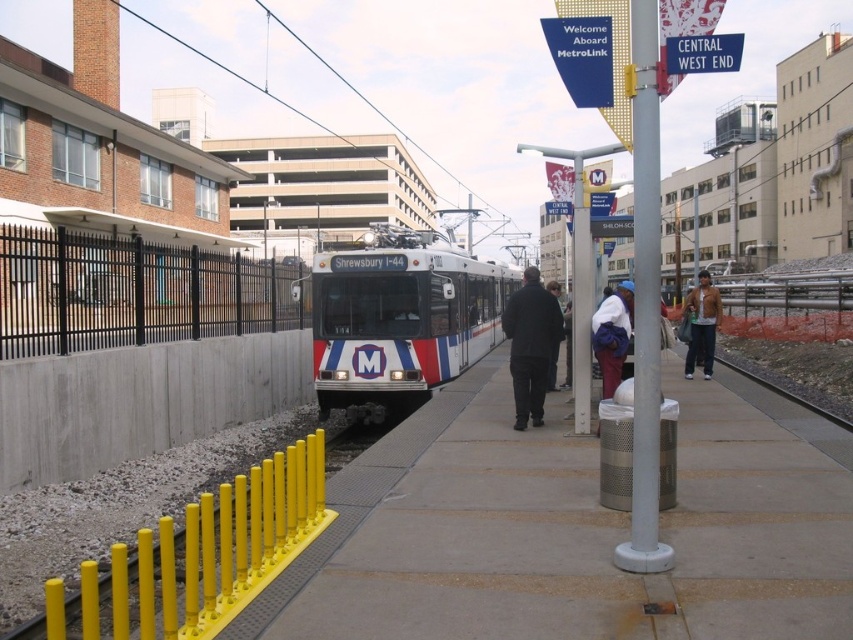
Question: Where is black matte jacket at center located in relation to white fabric bag at center in the image?

Choices:
 (A) left
 (B) right

Answer: (A)

Question: Is the position of black matte jacket at center more distant than that of leather jacket at right?

Choices:
 (A) no
 (B) yes

Answer: (A)

Question: Which point is farther to the camera?

Choices:
 (A) silver metallic pole at center
 (B) white fabric bag at center

Answer: (B)

Question: Which point is closer to the camera taking this photo?

Choices:
 (A) (622, 305)
 (B) (381, 330)
 (C) (631, 547)
 (D) (553, 280)

Answer: (C)

Question: Which of the following is the farthest from the observer?

Choices:
 (A) (695, 324)
 (B) (635, 186)

Answer: (A)

Question: Where is black matte jacket at center located in relation to white fabric bag at center in the image?

Choices:
 (A) left
 (B) right

Answer: (A)